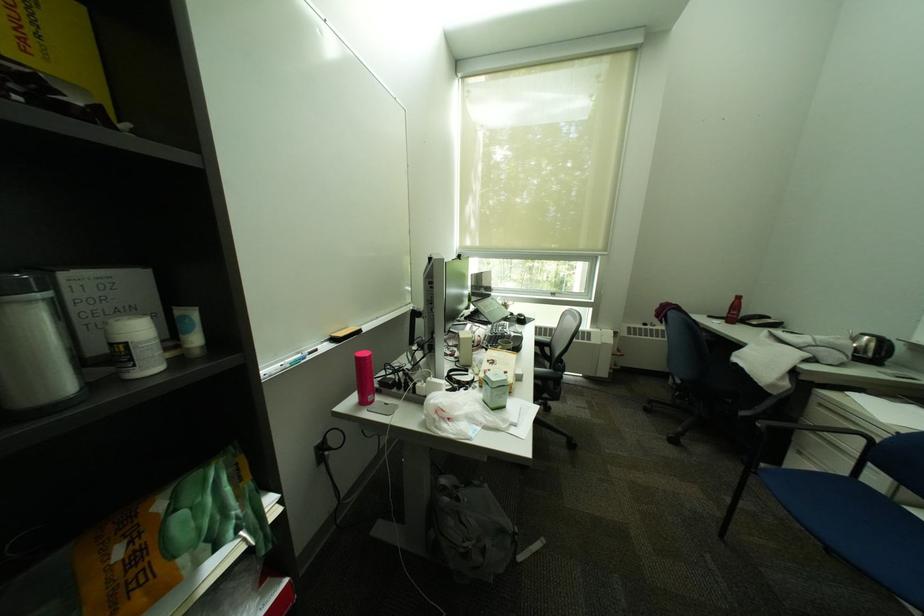
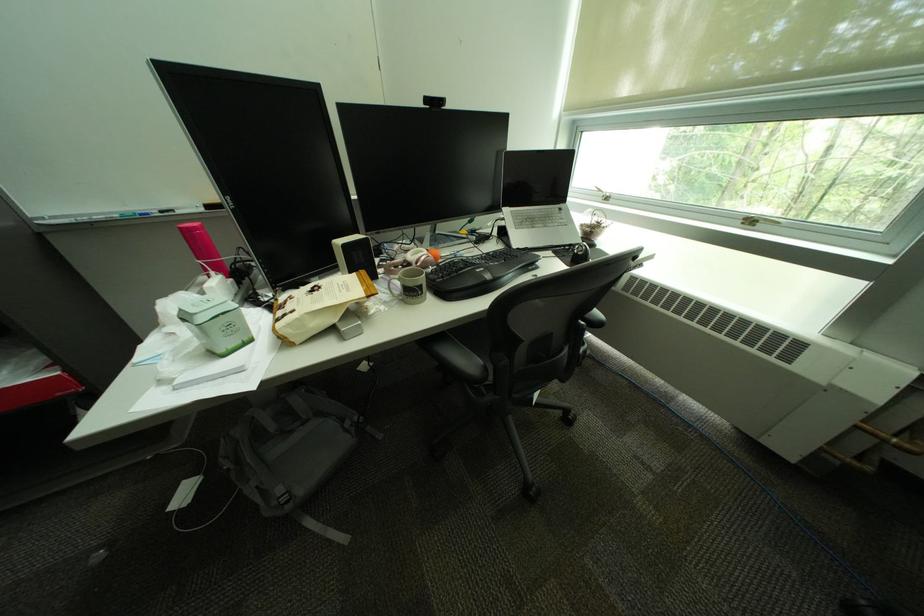
Find the pixel in the second image that matches point (564, 294) in the first image.

(761, 224)